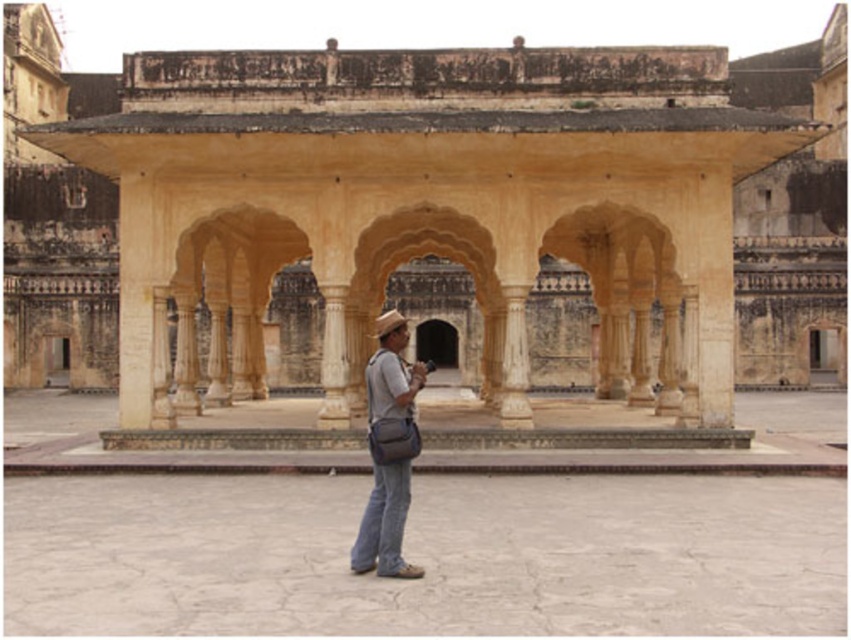
In the scene shown: You are standing in the historical structure and notice two items on the paved area. Which one is positioned to the left between the denim jeans at center and the denim at center?

The denim jeans at center is positioned to the left of the denim at center.

From the picture: You are standing at the entrance of the historical site and want to take a photo of the beige stone palace at center. If your camera can capture a 60 degree angle, will the entire palace fit in the frame?

The beige stone palace at center is positioned at coordinates point (437, 220), so it depends on the camera angle and distance. However, without specific measurements of the palace size relative to the camera, it is impossible to determine if it will fit in the frame.